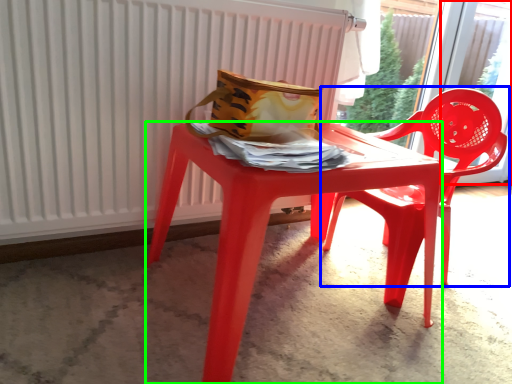
Question: Which object is the farthest from window (highlighted by a red box)? Choose among these: chair (highlighted by a blue box) or table (highlighted by a green box).

Choices:
 (A) chair
 (B) table

Answer: (B)